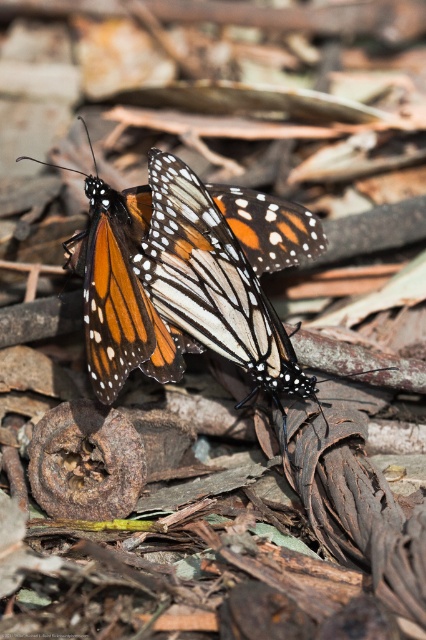
Question: Which point appears farthest from the camera in this image?

Choices:
 (A) (261, 305)
 (B) (126, 216)

Answer: (B)

Question: Is orange and white butterfly at center closer to camera compared to orange and white spotted butterfly at center?

Choices:
 (A) yes
 (B) no

Answer: (A)

Question: In this image, where is orange and white butterfly at center located relative to orange and white spotted butterfly at center?

Choices:
 (A) right
 (B) left

Answer: (B)

Question: Does orange and white butterfly at center have a greater width compared to orange and white spotted butterfly at center?

Choices:
 (A) yes
 (B) no

Answer: (A)